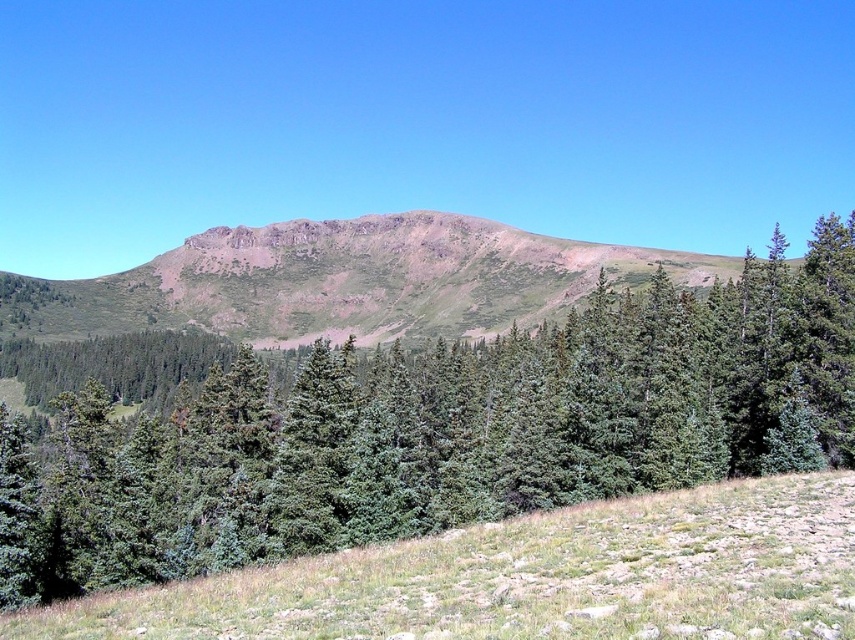
Question: Which object is farther from the camera taking this photo?

Choices:
 (A) rustic brown mountain at center
 (B) green matte tree at center

Answer: (A)

Question: Does green matte tree at center have a lesser width compared to green grassy hillside at lower center?

Choices:
 (A) no
 (B) yes

Answer: (A)

Question: Which point is farther to the camera?

Choices:
 (A) green grassy hillside at lower center
 (B) rustic brown mountain at center

Answer: (B)

Question: Which object appears closest to the camera in this image?

Choices:
 (A) green grassy hillside at lower center
 (B) rustic brown mountain at center
 (C) green matte tree at center

Answer: (A)

Question: Is green matte tree at center below rustic brown mountain at center?

Choices:
 (A) no
 (B) yes

Answer: (B)

Question: In this image, where is green matte tree at center located relative to rustic brown mountain at center?

Choices:
 (A) above
 (B) below

Answer: (B)